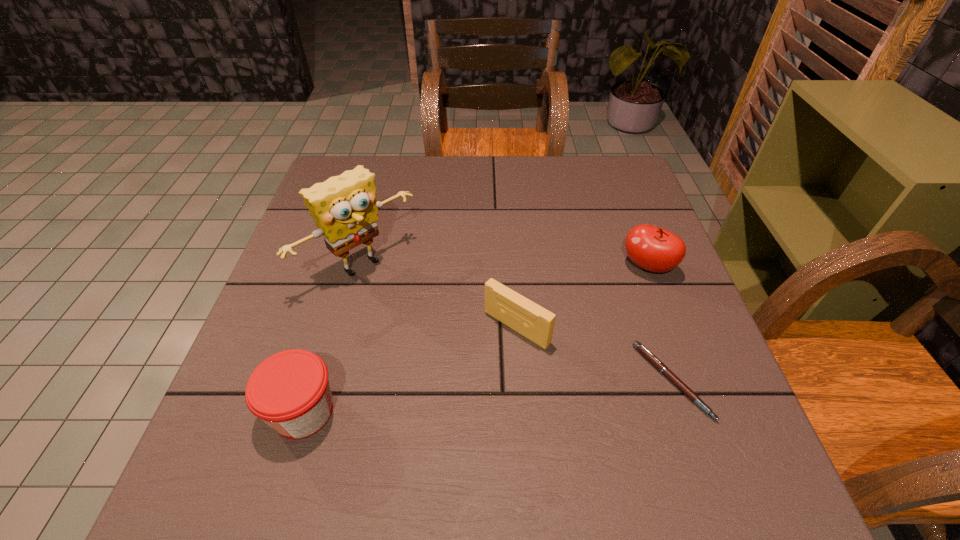
The height and width of the screenshot is (540, 960). Find the location of `pen that is at the right edge`. pen that is at the right edge is located at coordinates [658, 364].

Where is `apple at the right edge`? The height and width of the screenshot is (540, 960). apple at the right edge is located at coordinates (652, 248).

Find the location of a particular element. This screenshot has height=540, width=960. object at the near left corner is located at coordinates (290, 391).

This screenshot has height=540, width=960. Find the location of `object that is at the near right corner`. object that is at the near right corner is located at coordinates (658, 364).

The height and width of the screenshot is (540, 960). I want to click on free location at the far edge of the desktop, so click(434, 181).

Find the location of a particular element. This screenshot has width=960, height=540. vacant position at the near edge of the desktop is located at coordinates (544, 394).

Find the location of a particular element. The width and height of the screenshot is (960, 540). vacant space at the left edge is located at coordinates 342,301.

The width and height of the screenshot is (960, 540). In the image, there is a desktop. What are the coordinates of `vacant space at the right edge` in the screenshot? It's located at (627, 329).

You are a GUI agent. You are given a task and a screenshot of the screen. Output one action in this format:
    pyautogui.click(x=<x>, y=<y>)
    Task: Click on the blank space at the far right corner
    The image size is (960, 540).
    Given the screenshot: What is the action you would take?
    pyautogui.click(x=586, y=180)

The width and height of the screenshot is (960, 540). I want to click on unoccupied position between the third shortest object and the third object from left to right, so click(x=410, y=369).